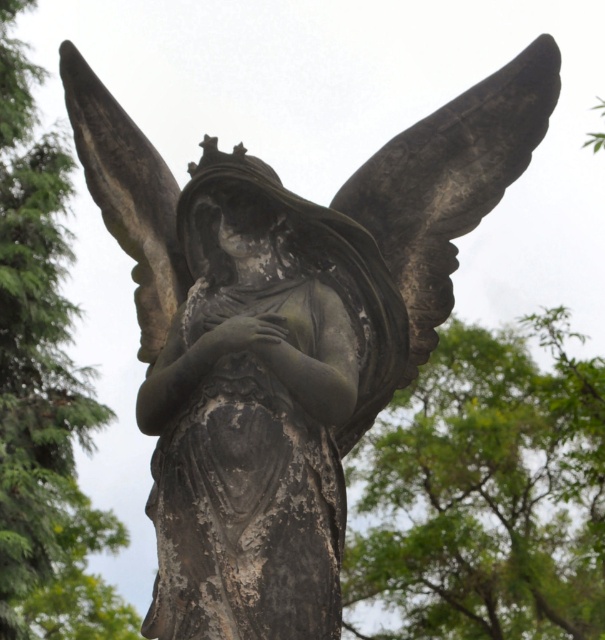
Between green leafy tree at center and dark gray stone wing at upper right, which one is positioned higher?

dark gray stone wing at upper right

Is point (554, 433) behind point (471, 196)?

Yes, point (554, 433) is farther from viewer.

The height and width of the screenshot is (640, 605). I want to click on green leafy tree at center, so click(485, 492).

Image resolution: width=605 pixels, height=640 pixels. I want to click on green leafy tree at center, so click(485, 492).

Between point (416, 358) and point (159, 332), which one is positioned in front?

Point (416, 358) is in front.

Measure the distance from dark gray stone wing at upper right to dark gray stone wing at upper left.

dark gray stone wing at upper right and dark gray stone wing at upper left are 9.72 meters apart.

Is point (522, 138) positioned after point (183, 284)?

Yes, point (522, 138) is behind point (183, 284).

The width and height of the screenshot is (605, 640). In order to click on dark gray stone wing at upper right in this screenshot , I will do `click(450, 182)`.

Who is shorter, green leafy tree at center or dark gray stone wing at upper left?

dark gray stone wing at upper left

Between green leafy tree at center and dark gray stone wing at upper left, which one is positioned higher?

dark gray stone wing at upper left is higher up.

Identify the location of green leafy tree at center. The image size is (605, 640). (485, 492).